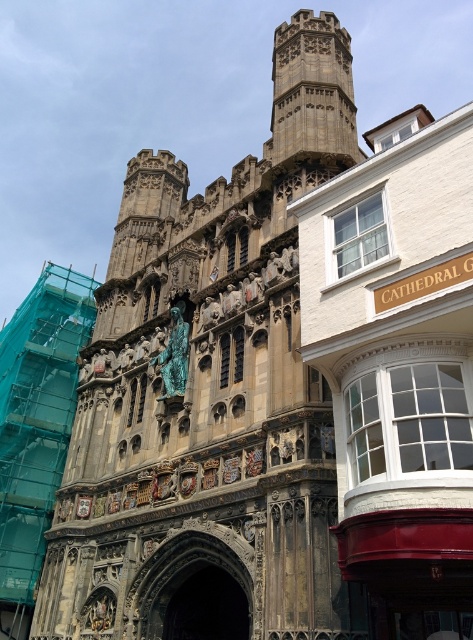
Question: Which point appears farthest from the camera in this image?

Choices:
 (A) (213, 220)
 (B) (81, 499)

Answer: (A)

Question: Does stone tower at center appear on the right side of gold metallic clock at center?

Choices:
 (A) yes
 (B) no

Answer: (A)

Question: From the image, what is the correct spatial relationship of stone tower at center in relation to gold metallic clock at center?

Choices:
 (A) below
 (B) above

Answer: (B)

Question: Does stone tower at center have a lesser width compared to gold metallic clock at center?

Choices:
 (A) yes
 (B) no

Answer: (B)